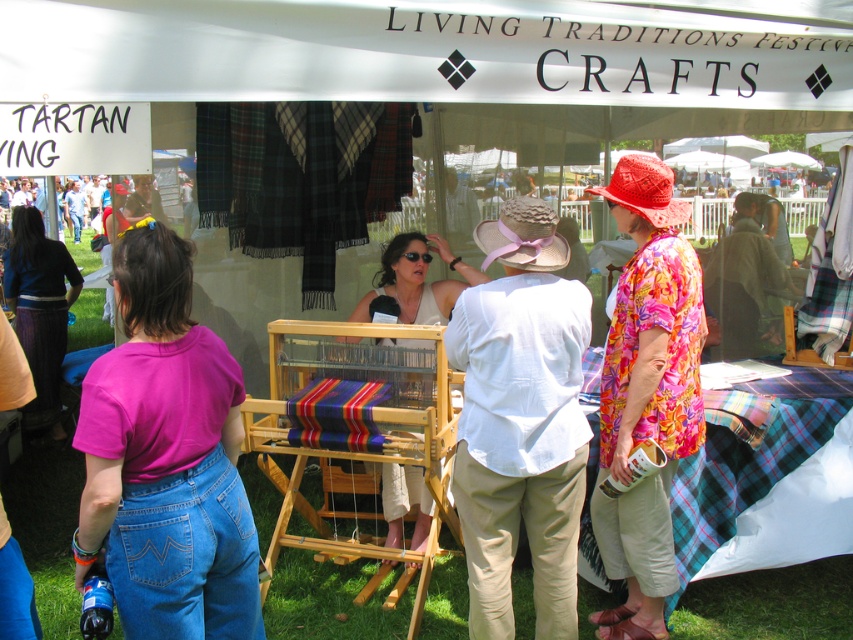
Question: Considering the relative positions of pink cotton shirt at center and matte white blouse at center in the image provided, where is pink cotton shirt at center located with respect to matte white blouse at center?

Choices:
 (A) above
 (B) below

Answer: (B)

Question: Can you confirm if pink cotton shirt at center is bigger than raffia straw cowboy hat at center?

Choices:
 (A) yes
 (B) no

Answer: (A)

Question: Considering the real-world distances, which object is farthest from the white cotton hat at center?

Choices:
 (A) raffia straw cowboy hat at center
 (B) matte white blouse at center

Answer: (B)

Question: Which point is closer to the camera taking this photo?

Choices:
 (A) (51, 413)
 (B) (509, 253)

Answer: (B)

Question: Which point is farther to the camera?

Choices:
 (A) matte blue sweater at center
 (B) floral fabric shirt at right

Answer: (A)

Question: Is white cotton hat at center to the right of matte blue sweater at center from the viewer's perspective?

Choices:
 (A) yes
 (B) no

Answer: (A)